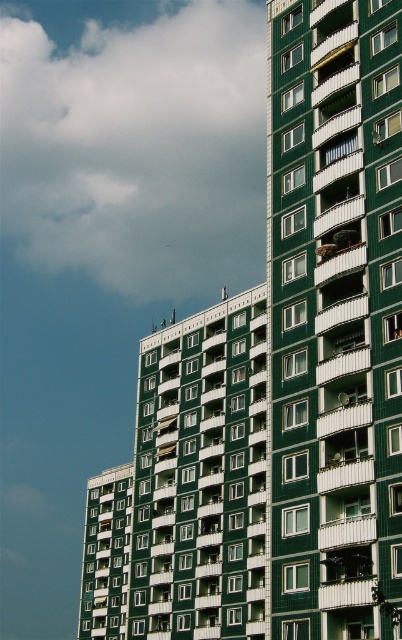
Question: Does green matte building at center have a smaller size compared to cloudy sky at upper left?

Choices:
 (A) yes
 (B) no

Answer: (A)

Question: Which point is closer to the camera taking this photo?

Choices:
 (A) (30, 234)
 (B) (340, 10)

Answer: (B)

Question: Which point appears farthest from the camera in this image?

Choices:
 (A) (289, 380)
 (B) (182, 212)

Answer: (B)

Question: Is green matte building at center to the right of cloudy sky at upper left from the viewer's perspective?

Choices:
 (A) yes
 (B) no

Answer: (A)

Question: Does green matte building at center lie in front of cloudy sky at upper left?

Choices:
 (A) no
 (B) yes

Answer: (B)